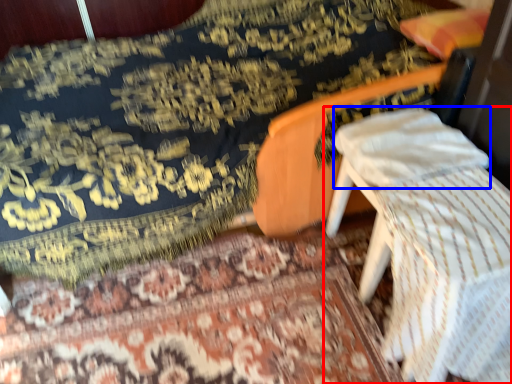
Question: Among these objects, which one is nearest to the camera, furniture (highlighted by a red box) or pillow (highlighted by a blue box)?

Choices:
 (A) furniture
 (B) pillow

Answer: (A)